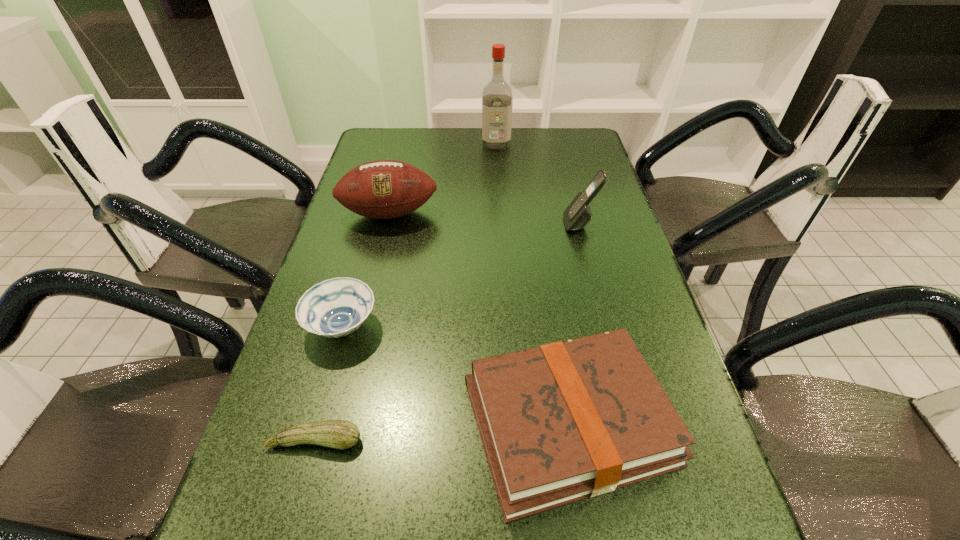
Find the location of a particular element. This screenshot has width=960, height=540. the tallest object is located at coordinates (497, 101).

Identify the location of liquor. (497, 101).

Locate an element on the screen. The height and width of the screenshot is (540, 960). cellular telephone is located at coordinates (578, 214).

Where is `football (American)`? football (American) is located at coordinates (383, 189).

At what (x,y) coordinates should I click in order to perform the action: click on hardback book. Please return your answer as a coordinate pair (x, y). Looking at the image, I should click on (569, 420).

You are a GUI agent. You are given a task and a screenshot of the screen. Output one action in this format:
    pyautogui.click(x=<x>, y=<y>)
    Task: Click on the soup bowl
    
    Given the screenshot: What is the action you would take?
    pyautogui.click(x=336, y=307)

Where is `zucchini`? This screenshot has height=540, width=960. zucchini is located at coordinates (341, 434).

Locate an element on the screen. This screenshot has width=960, height=540. blank area located 0.390m on the front-facing side of the tallest object is located at coordinates (500, 220).

The width and height of the screenshot is (960, 540). Find the location of `free region located on the front-facing side of the cellular telephone`. free region located on the front-facing side of the cellular telephone is located at coordinates (453, 224).

You are a GUI agent. You are given a task and a screenshot of the screen. Output one action in this format:
    pyautogui.click(x=<x>, y=<y>)
    Task: Click on the blank space located on the front-facing side of the cellular telephone
    This screenshot has height=540, width=960.
    Given the screenshot: What is the action you would take?
    pyautogui.click(x=503, y=224)